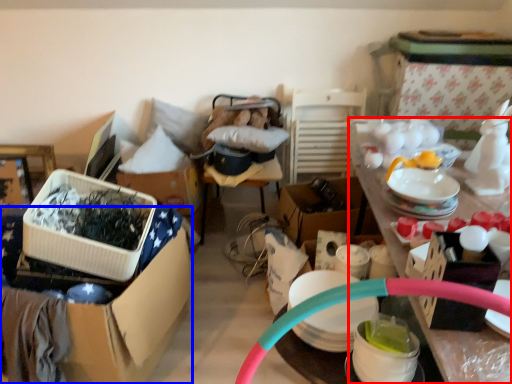
Question: Which of the following is the closest to the observer, desk (highlighted by a red box) or box (highlighted by a blue box)?

Choices:
 (A) desk
 (B) box

Answer: (A)